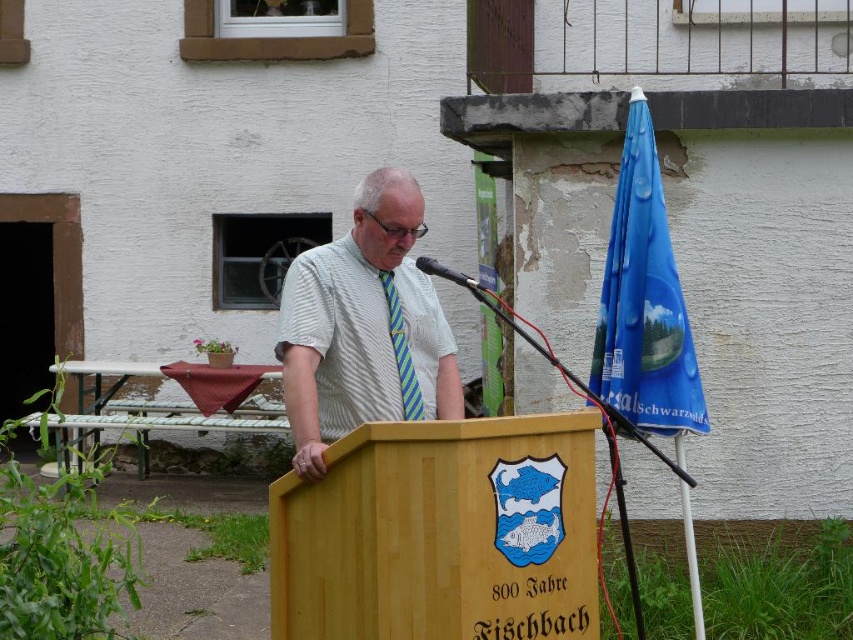
You are an event photographer capturing the speaker at the 800 Jahre Fischbach celebration. You notice the white striped shirt at center and the green striped tie at center. Which clothing item appears taller in the photo?

The white striped shirt at center appears taller than the green striped tie at center in the photo.

You are an event photographer capturing the speaker at the podium. You notice the white striped shirt at center and the green striped tie at center. Which one is positioned to the left from your viewpoint?

The white striped shirt at center is to the left of the green striped tie at center.

You are an event photographer at the 800 Jahre Fischbach celebration. You need to capture a closeup of the speaker wearing a white striped shirt at center and green striped tie at center. Which clothing item will appear wider in the photo?

The white striped shirt at center will appear wider in the photo because its width surpasses that of the green striped tie at center.